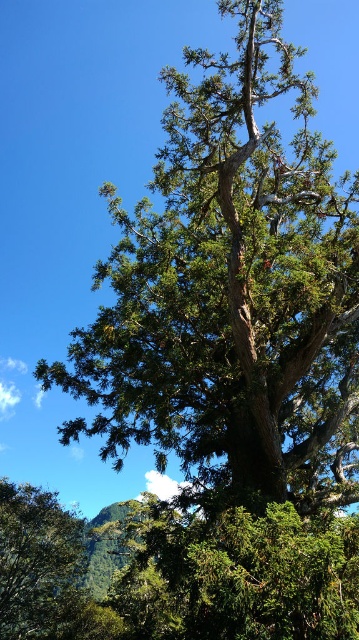
Question: Can you confirm if green rough bark tree at center is wider than green textured tree at lower left?

Choices:
 (A) yes
 (B) no

Answer: (A)

Question: Where is green rough bark tree at center located in relation to green textured tree at lower left in the image?

Choices:
 (A) right
 (B) left

Answer: (A)

Question: Which point is closer to the camera taking this photo?

Choices:
 (A) (131, 336)
 (B) (30, 586)

Answer: (A)

Question: Is green rough bark tree at center thinner than green textured tree at lower left?

Choices:
 (A) no
 (B) yes

Answer: (A)